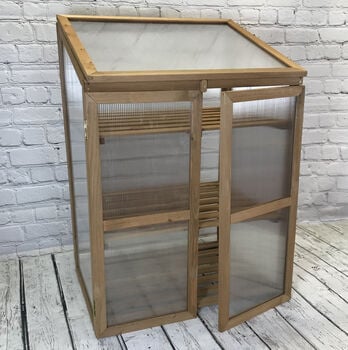
At what (x,y) coordinates should I click in order to perform the action: click on wood slatted shelf. Please return your answer as a coordinate pair (x, y). The height and width of the screenshot is (350, 348). Looking at the image, I should click on (206, 285), (207, 209), (209, 120).